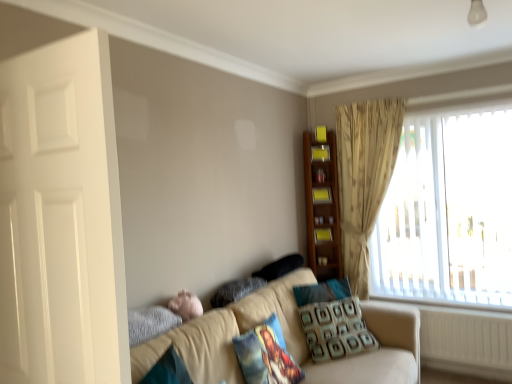
The height and width of the screenshot is (384, 512). I want to click on free spot above white plastic radiator at lower right (from a real-world perspective), so click(x=443, y=303).